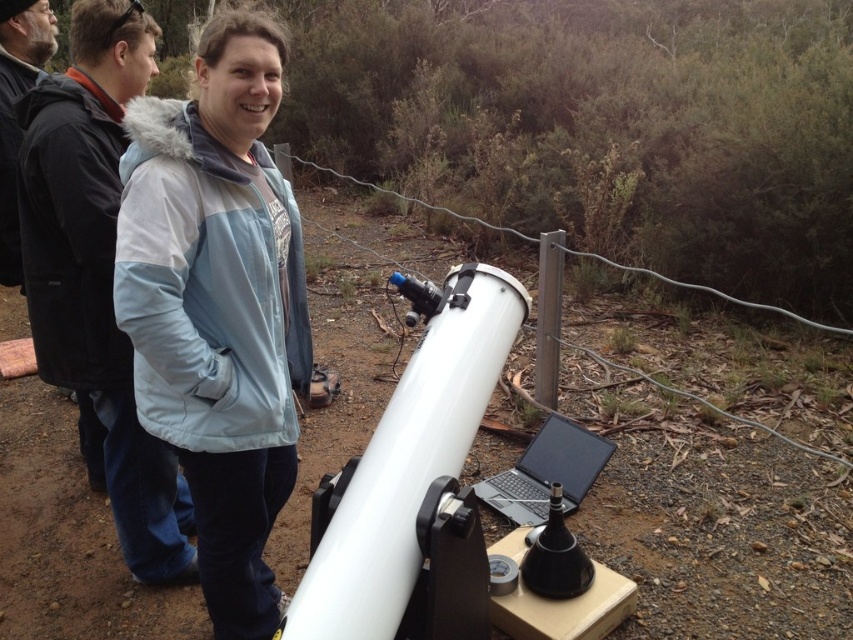
You are standing at the point marked by the coordinates point [218,307]. Looking around, you see the light blue puffy jacket at center. What object is located at your current position?

The light blue puffy jacket at center is located at point [218,307].

You are a photographer at the astronomy event and need to capture a group photo. The two jackets, black fleece jacket at upper left and black fuzzy jacket at left, are in the background. Which jacket will appear bigger in the photo?

The black fleece jacket at upper left will appear bigger in the photo because it is larger in size than the black fuzzy jacket at left.

You are a photographer trying to capture a photo of the light blue puffy jacket at center and the black fleece jacket at upper left. Which jacket should you focus on first if you want to ensure both are in focus without adjusting the camera focus?

The light blue puffy jacket at center is positioned under the black fleece jacket at upper left, so focusing on the black fleece jacket at upper left first would allow the light blue puffy jacket at center to be in focus as well since it is closer to the camera.